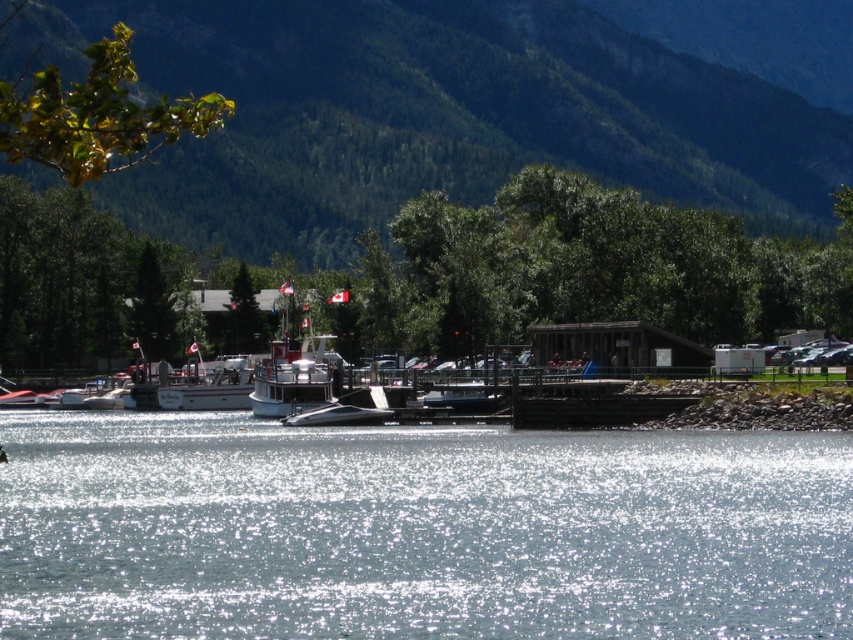
Question: Based on their relative distances, which object is nearer to the black wood dock at lower center?

Choices:
 (A) green leafy tree at upper left
 (B) sparkling silver water at center

Answer: (B)

Question: Which of the following is the closest to the observer?

Choices:
 (A) black wood dock at lower center
 (B) metallic blue boat at center

Answer: (A)

Question: Among these points, which one is nearest to the camera?

Choices:
 (A) (598, 404)
 (B) (271, 234)
 (C) (131, 35)
 (D) (352, 316)

Answer: (C)

Question: Does green leafy tree at center have a smaller size compared to shiny black boat at center?

Choices:
 (A) yes
 (B) no

Answer: (B)

Question: Where is sparkling silver water at center located in relation to green leafy tree at upper left in the image?

Choices:
 (A) left
 (B) right

Answer: (B)

Question: Does green forested mountain at upper center appear on the right side of black wood dock at lower center?

Choices:
 (A) yes
 (B) no

Answer: (B)